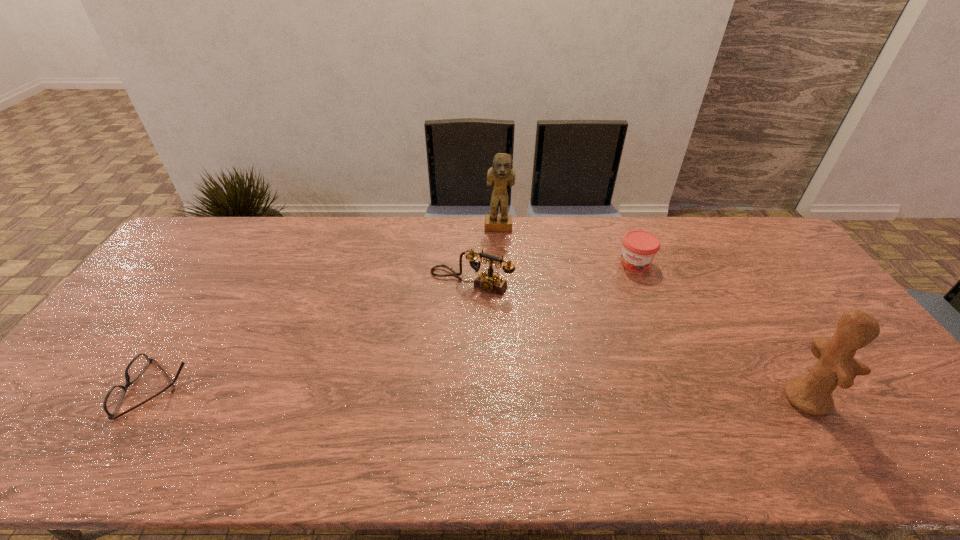
Locate an element on the screen. The width and height of the screenshot is (960, 540). free area in between the spectacles and the fourth object from left to right is located at coordinates (396, 326).

Locate an element on the screen. free space between the rightmost object and the jam is located at coordinates (721, 330).

Locate an element on the screen. This screenshot has width=960, height=540. vacant area between the farthest object and the nearer figurine is located at coordinates (652, 313).

The width and height of the screenshot is (960, 540). Identify the location of free space between the right figurine and the jam. (721, 330).

Identify the location of empty space between the third shortest object and the second object from right to left. (553, 272).

The width and height of the screenshot is (960, 540). Find the location of `free space that is in between the telephone and the fourth tallest object`. free space that is in between the telephone and the fourth tallest object is located at coordinates (553, 272).

I want to click on free space between the third tallest object and the rightmost object, so click(638, 340).

Locate an element on the screen. The height and width of the screenshot is (540, 960). vacant point located between the fourth tallest object and the spectacles is located at coordinates (396, 326).

Locate an element on the screen. The width and height of the screenshot is (960, 540). vacant space that is in between the right figurine and the telephone is located at coordinates (638, 340).

Image resolution: width=960 pixels, height=540 pixels. What are the coordinates of `vacant area between the farthest object and the jam` in the screenshot? It's located at tap(567, 245).